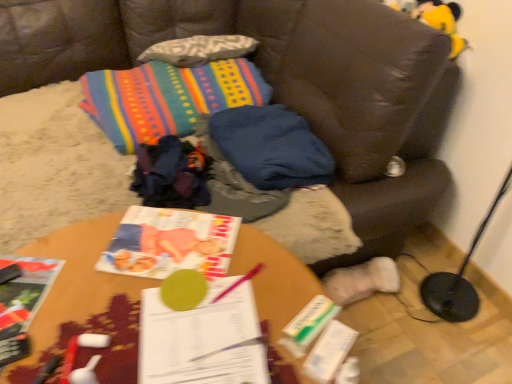
Measure the distance between point [444,17] and camera.

They are 1.38 meters apart.

The height and width of the screenshot is (384, 512). What do you see at coordinates (25, 292) in the screenshot?
I see `hardcover book at lower left, the third book from the right` at bounding box center [25, 292].

What is the approximate height of hardcover book at lower left, which appears as the 1th book when viewed from the left?

The height of hardcover book at lower left, which appears as the 1th book when viewed from the left, is 0.58 inches.

What are the coordinates of `white paper book at center, the 3th book positioned from the left` in the screenshot? It's located at (202, 339).

What is the approximate height of white paper book at center, which is the first book in right-to-left order?

It is 1.77 inches.

Locate an element on the screen. The image size is (512, 384). wooden table at center is located at coordinates (84, 304).

What are the coordinates of `matte paper book at center, which is counted as the 2th book, starting from the right` in the screenshot? It's located at (170, 243).

Which of these two, yellow plush toy at upper right or multicolored woven blanket at upper center, stands taller?

With more height is multicolored woven blanket at upper center.

Is point (430, 9) closer to viewer compared to point (110, 85)?

That is True.

From a real-world perspective, who is located higher, yellow plush toy at upper right or multicolored woven blanket at upper center?

yellow plush toy at upper right, from a real-world perspective.

Consider the image. Is yellow plush toy at upper right to the left of multicolored woven blanket at upper center from the viewer's perspective?

No, yellow plush toy at upper right is not to the left of multicolored woven blanket at upper center.

Which is behind, white paper book at center, which is the first book in right-to-left order, or hardcover book at lower left, which appears as the 1th book when viewed from the left?

hardcover book at lower left, which appears as the 1th book when viewed from the left.

Does white paper book at center, which is the first book in right-to-left order, contain hardcover book at lower left, the third book from the right?

No, hardcover book at lower left, the third book from the right, is located outside of white paper book at center, which is the first book in right-to-left order.

From a real-world perspective, which object stands above the other?

hardcover book at lower left, the third book from the right, from a real-world perspective.

From the white paper book at center, which is the first book in right-to-left order, count the 2nd book to the left and point to it. Please provide its 2D coordinates.

[(25, 292)]

Is point (178, 247) behind point (81, 77)?

No, (178, 247) is closer to viewer.

From the picture: Is matte paper book at center, the second book viewed from the left, positioned far away from multicolored woven blanket at upper center?

matte paper book at center, the second book viewed from the left, is actually quite close to multicolored woven blanket at upper center.

Looking at this image, is matte paper book at center, which is counted as the 2th book, starting from the right, taller or shorter than multicolored woven blanket at upper center?

Considering their sizes, matte paper book at center, which is counted as the 2th book, starting from the right, has less height than multicolored woven blanket at upper center.

Would you say matte paper book at center, the second book viewed from the left, is to the left or to the right of multicolored woven blanket at upper center in the picture?

matte paper book at center, the second book viewed from the left, is to the right of multicolored woven blanket at upper center.

Is hardcover book at lower left, the third book from the right, to the left or to the right of white paper book at center, which is the first book in right-to-left order, in the image?

From the image, it's evident that hardcover book at lower left, the third book from the right, is to the left of white paper book at center, which is the first book in right-to-left order.

Which book is the 2nd one when counting from the left side of the white paper book at center, the 3th book positioned from the left? Please provide its 2D coordinates.

[(25, 292)]

Is hardcover book at lower left, which appears as the 1th book when viewed from the left, wider than white paper book at center, the 3th book positioned from the left?

No, hardcover book at lower left, which appears as the 1th book when viewed from the left, is not wider than white paper book at center, the 3th book positioned from the left.

Is hardcover book at lower left, the third book from the right, in contact with white paper book at center, the 3th book positioned from the left?

No, hardcover book at lower left, the third book from the right, is not beside white paper book at center, the 3th book positioned from the left.

Who is bigger, hardcover book at lower left, the third book from the right, or wooden table at center?

Bigger between the two is wooden table at center.

From a real-world perspective, relative to wooden table at center, is hardcover book at lower left, which appears as the 1th book when viewed from the left, vertically above or below?

hardcover book at lower left, which appears as the 1th book when viewed from the left, is situated higher than wooden table at center in the real world.

How many degrees apart are the facing directions of multicolored woven blanket at upper center and white paper book at center, which is the first book in right-to-left order?

The angular difference between multicolored woven blanket at upper center and white paper book at center, which is the first book in right-to-left order, is 80.8 degrees.

Where is `throw pillow above the white paper book at center, the 3th book positioned from the left (from the image's perspective)`? throw pillow above the white paper book at center, the 3th book positioned from the left (from the image's perspective) is located at coordinates (167, 98).

Is multicolored woven blanket at upper center turned away from white paper book at center, which is the first book in right-to-left order?

multicolored woven blanket at upper center does not have its back to white paper book at center, which is the first book in right-to-left order.

From the image's perspective, is multicolored woven blanket at upper center beneath white paper book at center, which is the first book in right-to-left order?

No, from the image's perspective, multicolored woven blanket at upper center is not beneath white paper book at center, which is the first book in right-to-left order.

From the image's perspective, is multicolored woven blanket at upper center located above or below yellow plush toy at upper right?

Clearly, from the image's perspective, multicolored woven blanket at upper center is below yellow plush toy at upper right.

Is point (216, 64) closer or farther from the camera than point (450, 19)?

Point (216, 64) appears to be farther away from the viewer than point (450, 19).

Are multicolored woven blanket at upper center and yellow plush toy at upper right located far from each other?

Actually, multicolored woven blanket at upper center and yellow plush toy at upper right are a little close together.

Does multicolored woven blanket at upper center have a smaller size compared to yellow plush toy at upper right?

Incorrect, multicolored woven blanket at upper center is not smaller in size than yellow plush toy at upper right.

Find the location of a particular element. This screenshot has height=384, width=512. toy that is above the multicolored woven blanket at upper center (from the image's perspective) is located at coordinates (441, 20).

Find the location of `the 2nd book to the left when counting from the white paper book at center, which is the first book in right-to-left order`. the 2nd book to the left when counting from the white paper book at center, which is the first book in right-to-left order is located at coordinates (25, 292).

Based on the photo, based on their spatial positions, is hardcover book at lower left, the third book from the right, or brown leather couch at center further from multicolored woven blanket at upper center?

hardcover book at lower left, the third book from the right, is further to multicolored woven blanket at upper center.

From the image, which object appears to be nearer to wooden table at center, white paper book at center, which is the first book in right-to-left order, or brown leather couch at center?

white paper book at center, which is the first book in right-to-left order, is positioned closer to the anchor wooden table at center.

Estimate the real-world distances between objects in this image. Which object is further from matte paper book at center, which is counted as the 2th book, starting from the right, wooden table at center or blue fabric pillow at center?

blue fabric pillow at center.

Which object lies further to the anchor point hardcover book at lower left, which appears as the 1th book when viewed from the left, white paper book at center, which is the first book in right-to-left order, or yellow plush toy at upper right?

yellow plush toy at upper right.

Estimate the real-world distances between objects in this image. Which object is closer to blue fabric pillow at center, white paper book at center, which is the first book in right-to-left order, or yellow plush toy at upper right?

yellow plush toy at upper right.

Estimate the real-world distances between objects in this image. Which object is further from brown leather couch at center, wooden table at center or blue fabric pillow at center?

wooden table at center.

When comparing their distances from matte paper book at center, the second book viewed from the left, does multicolored woven blanket at upper center or hardcover book at lower left, the third book from the right, seem further?

multicolored woven blanket at upper center lies further to matte paper book at center, the second book viewed from the left, than the other object.

Looking at the image, which one is located further to brown leather couch at center, wooden table at center or multicolored woven blanket at upper center?

wooden table at center is further to brown leather couch at center.

The width and height of the screenshot is (512, 384). Find the location of `book between hardcover book at lower left, the third book from the right, and multicolored woven blanket at upper center in the front-back direction`. book between hardcover book at lower left, the third book from the right, and multicolored woven blanket at upper center in the front-back direction is located at coordinates (170, 243).

Find the location of a particular element. This screenshot has width=512, height=384. book between brown leather couch at center and hardcover book at lower left, the third book from the right, from top to bottom is located at coordinates (170, 243).

At what (x,y) coordinates should I click in order to perform the action: click on pillow between matte paper book at center, the second book viewed from the left, and multicolored woven blanket at upper center from front to back. Please return your answer as a coordinate pair (x, y). The image size is (512, 384). Looking at the image, I should click on (271, 147).

Find the location of a particular element. The height and width of the screenshot is (384, 512). pillow between brown leather couch at center and yellow plush toy at upper right from left to right is located at coordinates (271, 147).